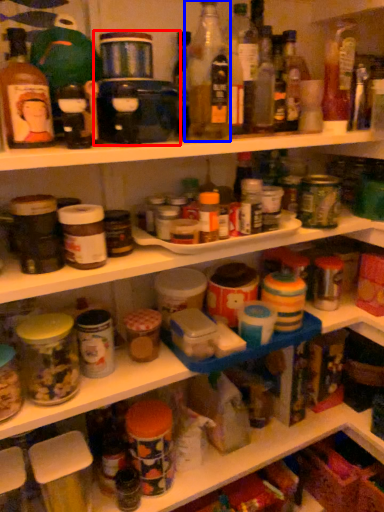
Question: Which point is closer to the camera, appliance (highlighted by a red box) or bottle (highlighted by a blue box)?

Choices:
 (A) appliance
 (B) bottle

Answer: (B)